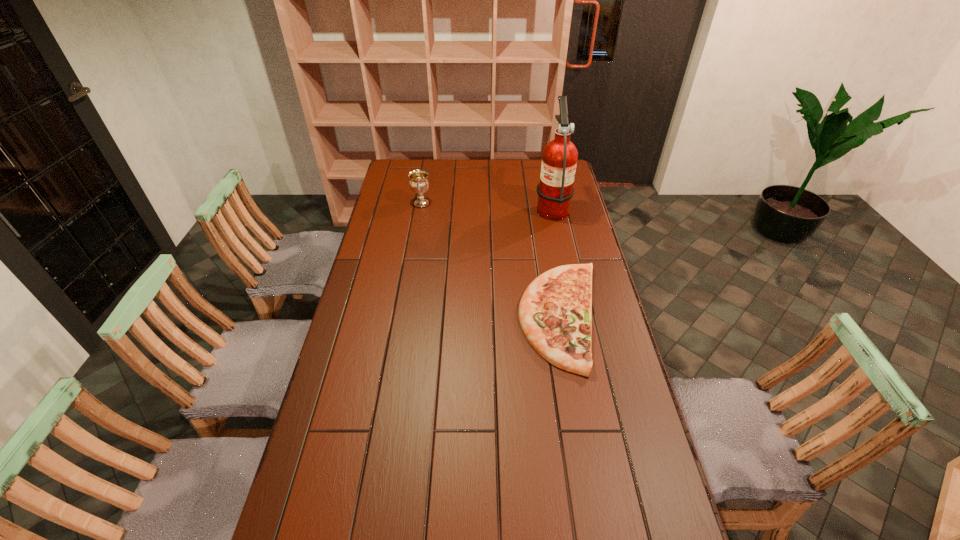
Identify the location of fire extinguisher. (555, 190).

At what (x,y) coordinates should I click in order to perform the action: click on chalice. Please return your answer as a coordinate pair (x, y). The image size is (960, 540). Looking at the image, I should click on 419,183.

Identify the location of the leftmost object. (419, 183).

This screenshot has height=540, width=960. I want to click on the shortest object, so click(555, 312).

Find the location of a particular element. The height and width of the screenshot is (540, 960). pizza is located at coordinates (555, 312).

Image resolution: width=960 pixels, height=540 pixels. Find the location of `vacant space located 0.340m on the nozzle and handle of the tallest object`. vacant space located 0.340m on the nozzle and handle of the tallest object is located at coordinates (460, 207).

This screenshot has width=960, height=540. What are the coordinates of `free region located on the nozzle and handle of the tallest object` in the screenshot? It's located at (473, 207).

The image size is (960, 540). I want to click on vacant space situated on the nozzle and handle of the tallest object, so pos(451,207).

The image size is (960, 540). Find the location of `blank space located on the back of the leftmost object`. blank space located on the back of the leftmost object is located at coordinates (424, 189).

Where is `free space located on the back of the pizza`? Image resolution: width=960 pixels, height=540 pixels. free space located on the back of the pizza is located at coordinates (543, 216).